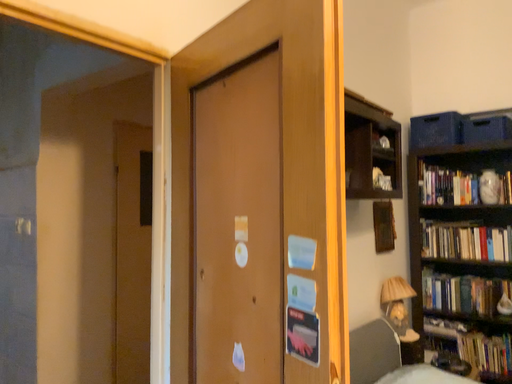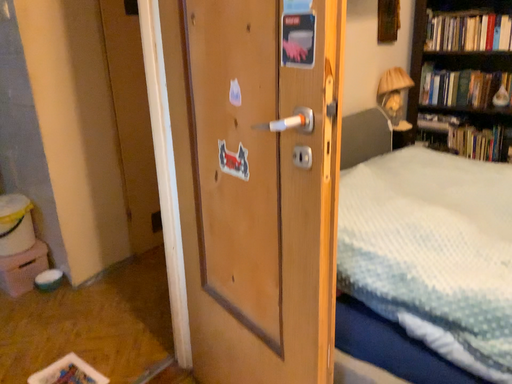
Question: How did the camera likely rotate when shooting the video?

Choices:
 (A) rotated upward
 (B) rotated downward

Answer: (B)